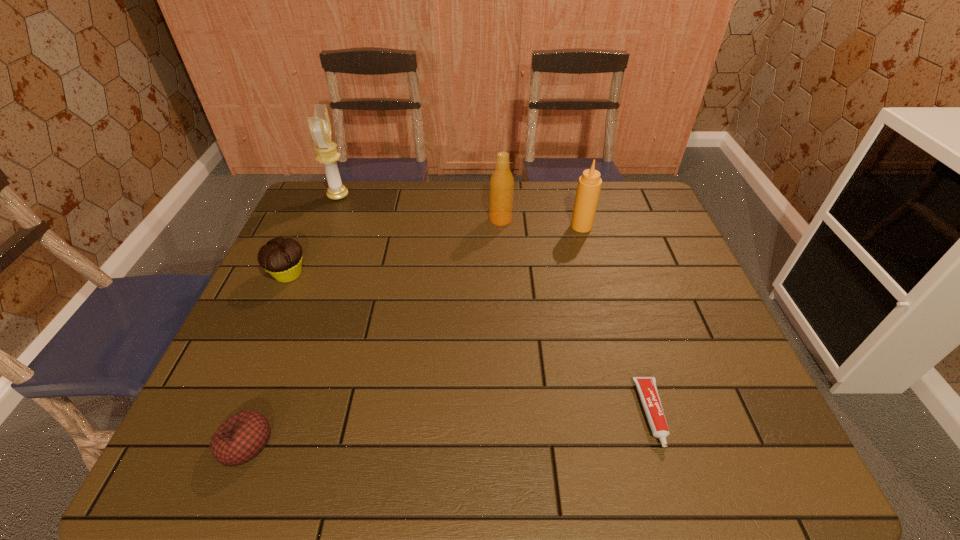
Locate an element on the screen. The height and width of the screenshot is (540, 960). the tallest object is located at coordinates (320, 127).

What are the coordinates of `award` in the screenshot? It's located at (320, 127).

Find the location of `condiment`. condiment is located at coordinates (589, 185).

You are a GUI agent. You are given a task and a screenshot of the screen. Output one action in this format:
    pyautogui.click(x=<x>, y=<y>)
    Task: Click on the fourth object from left to right
    This screenshot has width=960, height=540.
    Given the screenshot: What is the action you would take?
    pyautogui.click(x=501, y=182)

I want to click on the fourth farthest object, so click(282, 258).

Where is `the third shortest object`? This screenshot has width=960, height=540. the third shortest object is located at coordinates (282, 258).

At what (x,y) coordinates should I click in order to perform the action: click on beanbag. Please return your answer as a coordinate pair (x, y). This screenshot has width=960, height=540. Looking at the image, I should click on (241, 437).

I want to click on the shortest object, so click(x=647, y=389).

Find the location of a particular element. The height and width of the screenshot is (540, 960). vacant space located on the front-facing side of the award is located at coordinates (384, 196).

The height and width of the screenshot is (540, 960). I want to click on free space located 0.380m on the front of the condiment, so click(x=609, y=328).